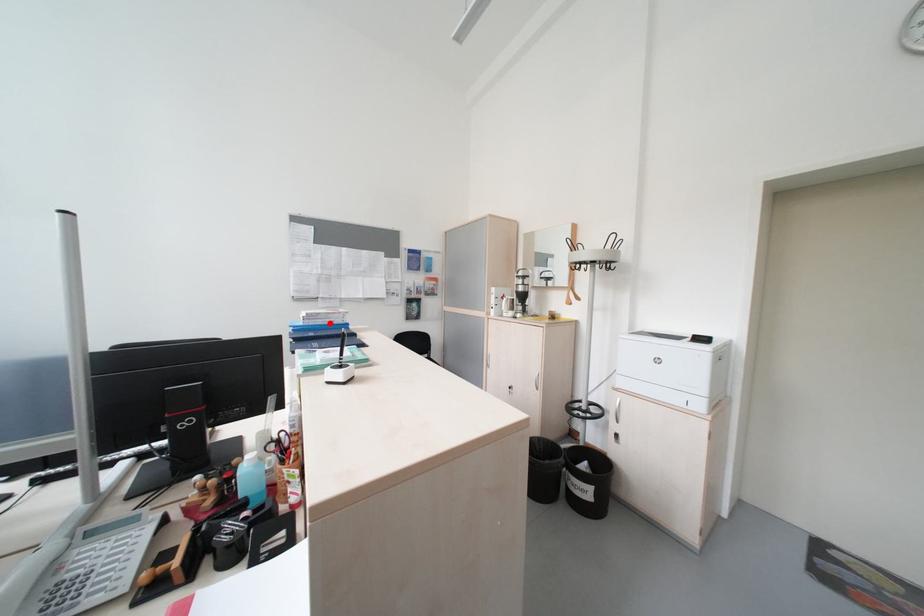
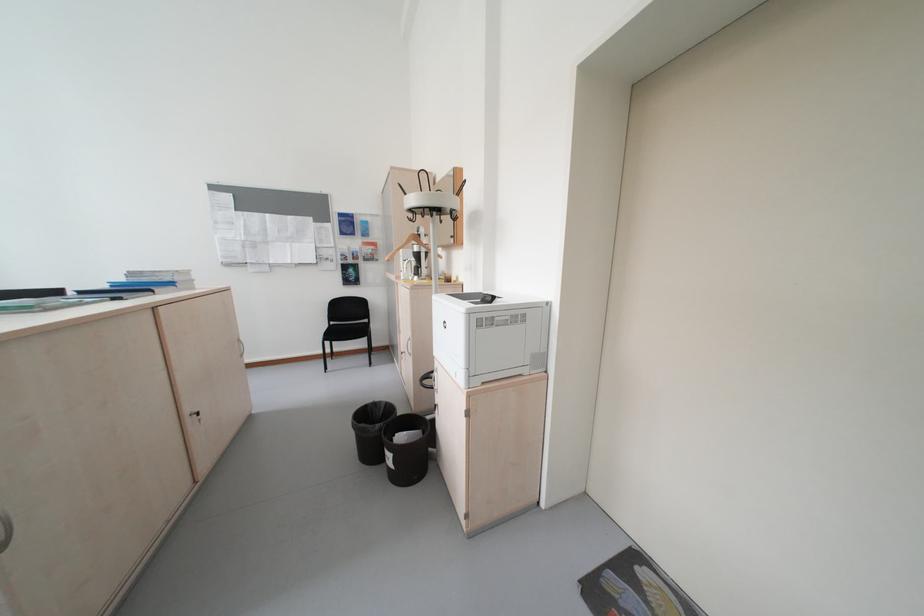
Where in the second image is the point corresponding to the highlighted location from the first image?

(155, 281)